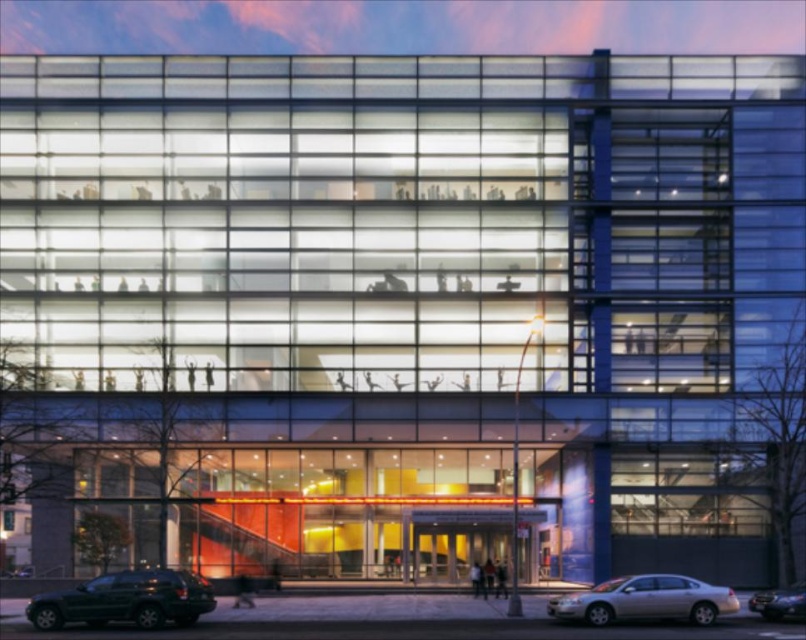
You are a delivery person trying to park your truck next to the silver metallic sedan at lower right and the shiny silver sedan at lower right. Which sedan should you park next to to have enough space for your truck?

You should park next to the shiny silver sedan at lower right because the silver metallic sedan at lower right is wider than the shiny silver sedan at lower right, leaving less space for your truck.

You are a pedestrian standing in front of the modern building and want to cross the street. You see the shiny dark green suv at lower left and the silver metallic sedan at lower right. Which vehicle is closer to you?

The shiny dark green suv at lower left is closer to you because it is further to the viewer than the silver metallic sedan at lower right.